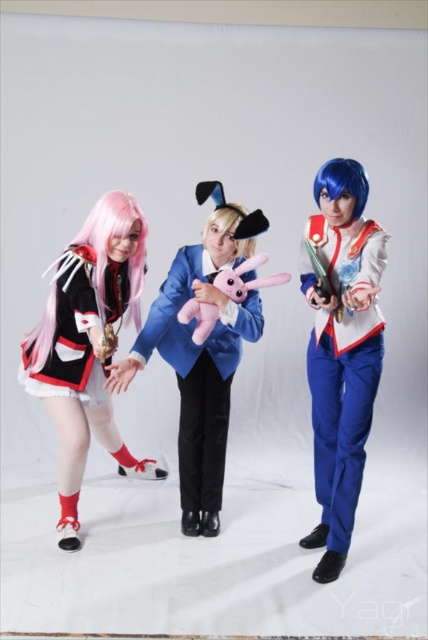
Question: Which object is positioned closest to the blondehairwig at center?

Choices:
 (A) blue matte wig at right
 (B) matte black dress at left
 (C) pink plush toy at center
 (D) velvet plush toy at center

Answer: (C)

Question: Is the position of matte pink plush at left more distant than that of velvet plush toy at center?

Choices:
 (A) yes
 (B) no

Answer: (B)

Question: Based on their relative distances, which object is nearer to the matte pink plush at left?

Choices:
 (A) blondehairwig at center
 (B) blue matte wig at right

Answer: (A)

Question: Which point is farther to the camera?

Choices:
 (A) (240, 252)
 (B) (83, 243)

Answer: (A)

Question: Does pink plush toy at center come in front of blue matte wig at right?

Choices:
 (A) yes
 (B) no

Answer: (A)

Question: Is matte pink plush at left wider than shiny blue fabric uniform at right?

Choices:
 (A) no
 (B) yes

Answer: (B)